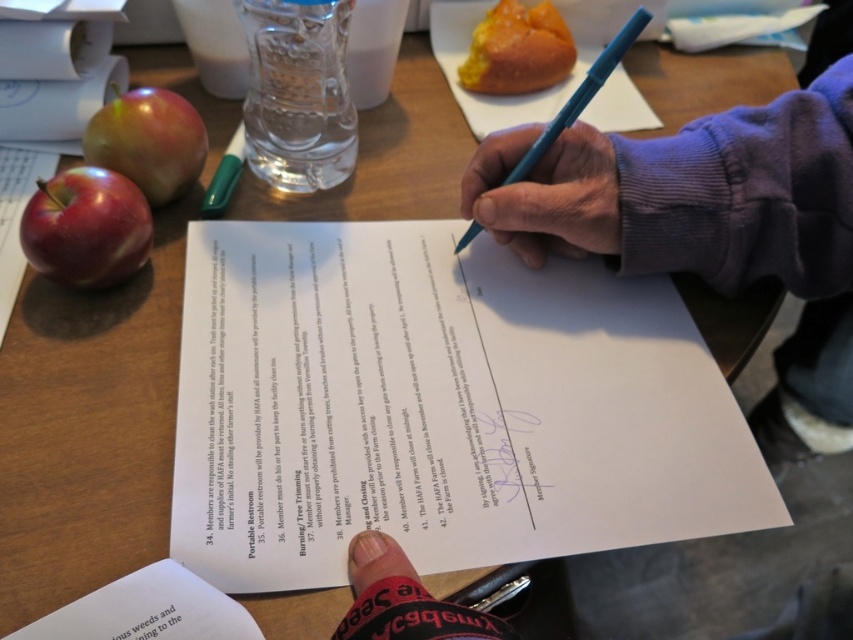
You are a photographer who needs to capture a close shot of the shiny red apple at left. The camera you are using has a minimum focusing distance of 16 inches. Can you take the photo without moving either the apple or the camera?

The shiny red apple at left and camera are 16.79 inches apart from each other. Since the minimum focusing distance of the camera is 16 inches, you can take the photo without moving either the apple or the camera because the distance is sufficient.

You are organizing a picnic and have both the shiny red apple at upper left and the black paper at lower left on your table. Which item is positioned higher up on the table?

The shiny red apple at upper left is positioned higher up on the table than the black paper at lower left.

You are a delivery person who needs to place a small package between the shiny red apple at left and the shiny red apple at upper left. The package is 2 inches long. Can you fit it there?

The distance between the shiny red apple at left and the shiny red apple at upper left is 2.10 inches. Since the package is 2 inches long, it can fit in the space between them.